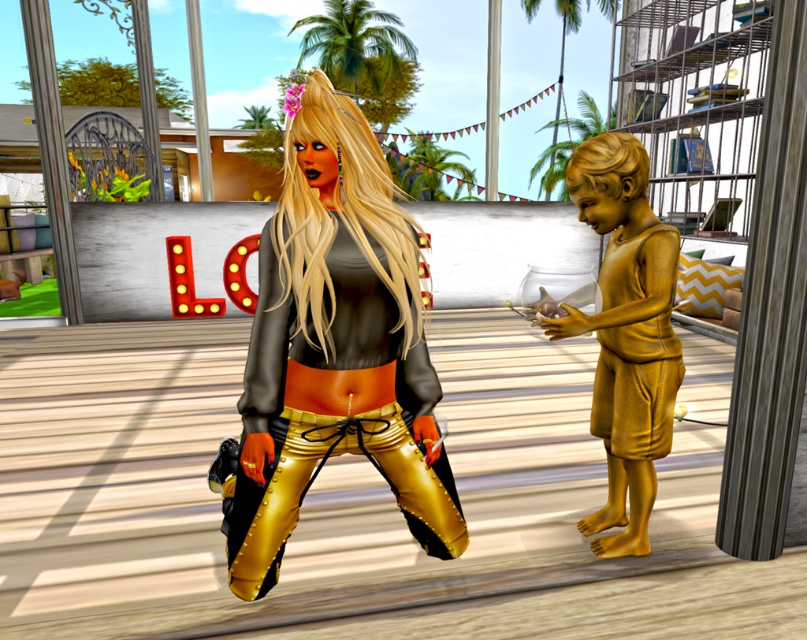
Is point (408, 259) behind point (644, 323)?

No, (408, 259) is in front of (644, 323).

Which is more to the right, metallic gold pants at center or gold metallic statue at right?

Positioned to the right is gold metallic statue at right.

Describe the element at coordinates (333, 346) in the screenshot. The width and height of the screenshot is (807, 640). I see `metallic gold pants at center` at that location.

At what (x,y) coordinates should I click in order to perform the action: click on metallic gold pants at center. Please return your answer as a coordinate pair (x, y). This screenshot has height=640, width=807. Looking at the image, I should click on (333, 346).